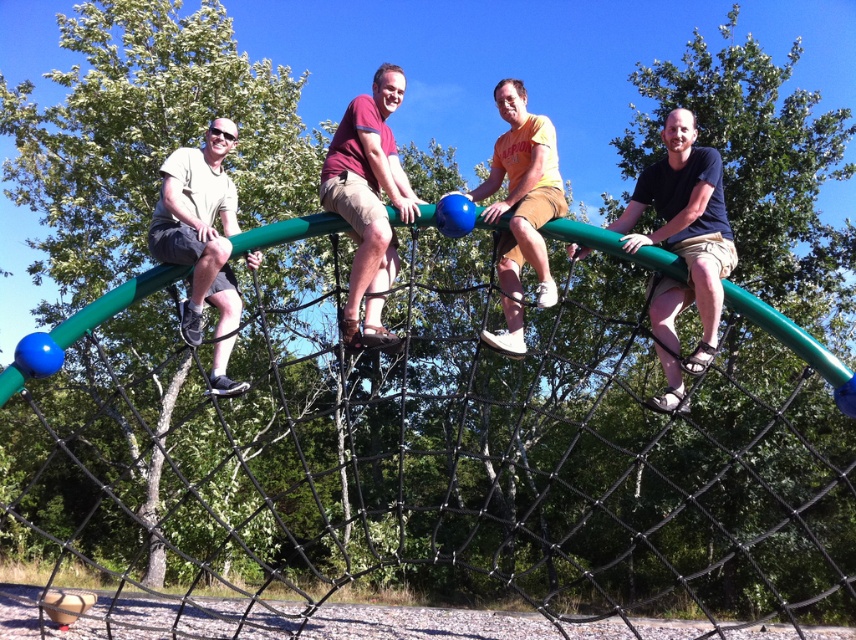
Question: Does black matte shorts at upper right come in front of matte khaki shorts at left?

Choices:
 (A) no
 (B) yes

Answer: (B)

Question: Based on their relative distances, which object is nearer to the green rubber rope bridge at upper center?

Choices:
 (A) matte khaki shorts at left
 (B) black matte shorts at upper right

Answer: (B)

Question: Does black matte shorts at upper right appear under orange t-shirt at center?

Choices:
 (A) no
 (B) yes

Answer: (B)

Question: Is green rubber rope bridge at upper center above black matte shorts at upper right?

Choices:
 (A) no
 (B) yes

Answer: (A)

Question: Which of the following is the closest to the observer?

Choices:
 (A) (669, 189)
 (B) (842, 496)
 (C) (515, 211)
 (D) (324, 205)

Answer: (D)

Question: Which object is farther from the camera taking this photo?

Choices:
 (A) matte khaki shorts at left
 (B) black matte shorts at upper right
 (C) orange t-shirt at center
 (D) green rubber rope bridge at upper center

Answer: (C)